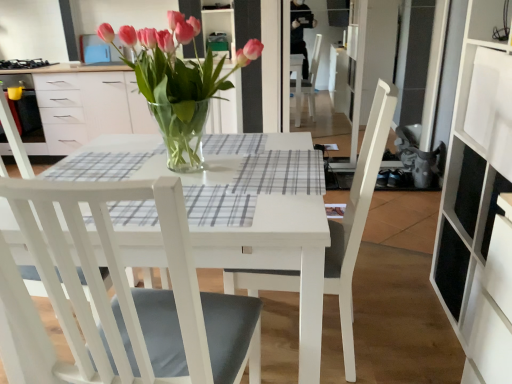
Question: Does white wood chair at center, acting as the 1th chair starting from the right, appear on the right side of pink glass vase at center?

Choices:
 (A) no
 (B) yes

Answer: (B)

Question: From a real-world perspective, is white wood chair at center, acting as the 1th chair starting from the right, on pink glass vase at center?

Choices:
 (A) no
 (B) yes

Answer: (A)

Question: Does white wood chair at center, placed as the 2th chair when sorted from left to right, have a larger size compared to pink glass vase at center?

Choices:
 (A) no
 (B) yes

Answer: (B)

Question: Does white wood chair at center, acting as the 1th chair starting from the right, come behind pink glass vase at center?

Choices:
 (A) yes
 (B) no

Answer: (B)

Question: Can you confirm if white wood chair at center, acting as the 1th chair starting from the right, is smaller than pink glass vase at center?

Choices:
 (A) yes
 (B) no

Answer: (B)

Question: Can you confirm if white wood chair at center, acting as the 1th chair starting from the right, is positioned to the left of pink glass vase at center?

Choices:
 (A) yes
 (B) no

Answer: (B)

Question: Considering the relative sizes of white wood chair at center, acting as the 1th chair starting from the right, and black matte gas stove at upper left in the image provided, is white wood chair at center, acting as the 1th chair starting from the right, taller than black matte gas stove at upper left?

Choices:
 (A) yes
 (B) no

Answer: (A)

Question: Is white wood chair at center, placed as the 2th chair when sorted from left to right, not inside black matte gas stove at upper left?

Choices:
 (A) yes
 (B) no

Answer: (A)

Question: Is white wood chair at center, acting as the 1th chair starting from the right, to the right of black matte gas stove at upper left from the viewer's perspective?

Choices:
 (A) no
 (B) yes

Answer: (B)

Question: Is white wood chair at center, acting as the 1th chair starting from the right, next to black matte gas stove at upper left and touching it?

Choices:
 (A) yes
 (B) no

Answer: (B)

Question: From a real-world perspective, is white wood chair at center, placed as the 2th chair when sorted from left to right, located higher than black matte gas stove at upper left?

Choices:
 (A) yes
 (B) no

Answer: (B)

Question: Is the depth of white wood chair at center, acting as the 1th chair starting from the right, greater than that of black matte gas stove at upper left?

Choices:
 (A) yes
 (B) no

Answer: (B)

Question: From the image's perspective, is black matte gas stove at upper left on pink glass vase at center?

Choices:
 (A) yes
 (B) no

Answer: (A)